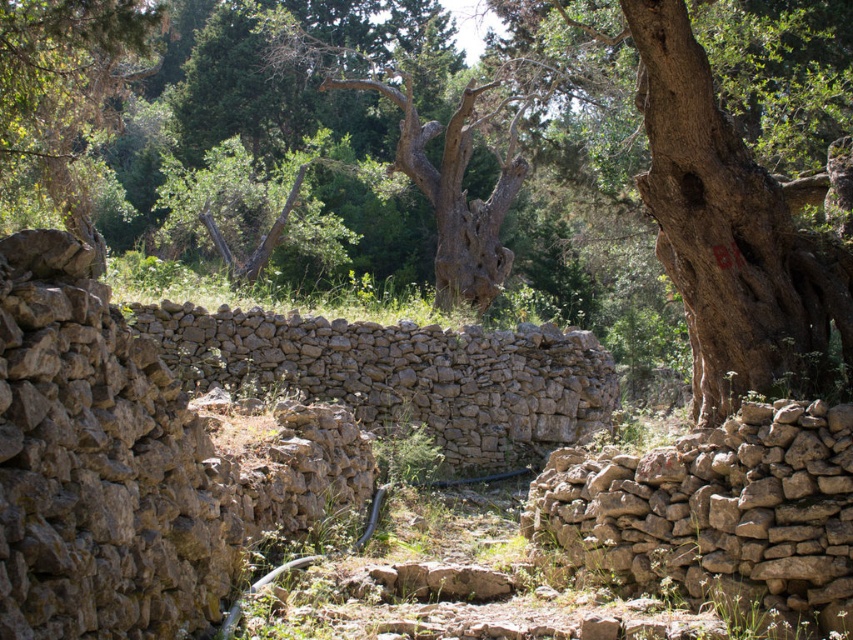
Question: Which of the following is the farthest from the observer?

Choices:
 (A) (784, 212)
 (B) (825, 515)

Answer: (A)

Question: Can you confirm if smooth brown tree trunk at center is wider than brown rough stone at right?

Choices:
 (A) yes
 (B) no

Answer: (A)

Question: In this image, where is smooth brown tree trunk at center located relative to brown rough stone at right?

Choices:
 (A) below
 (B) above

Answer: (B)

Question: Which point is farther from the camera taking this photo?

Choices:
 (A) (734, 577)
 (B) (485, 186)

Answer: (B)

Question: Is smooth brown tree trunk at center to the left of brown rough stone at right from the viewer's perspective?

Choices:
 (A) no
 (B) yes

Answer: (B)